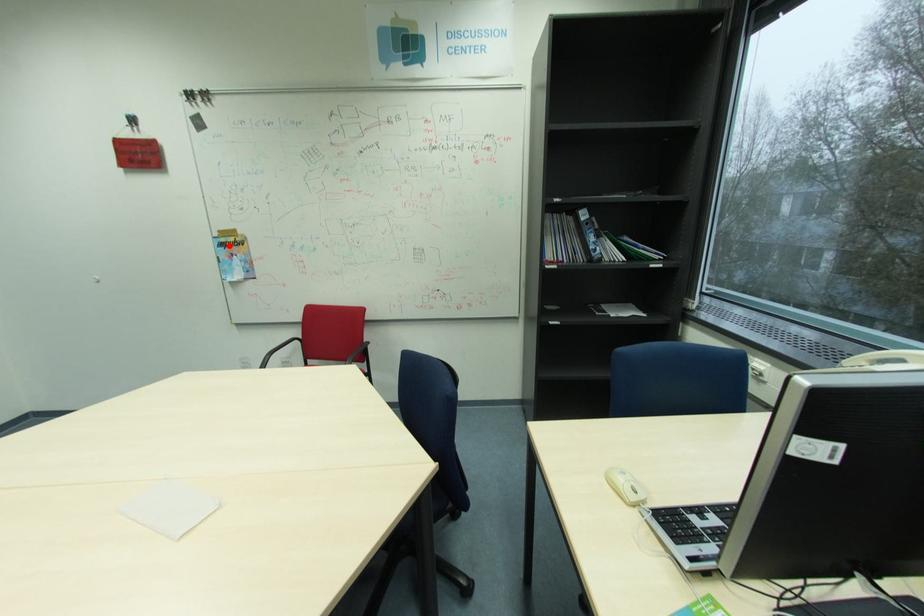
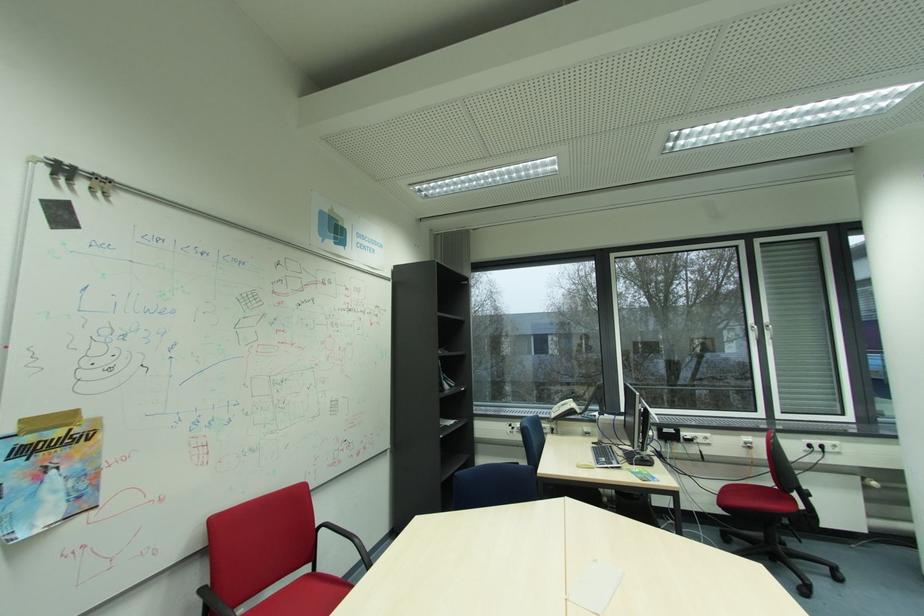
In the second image, find the point that corresponds to the highlighted location in the first image.

(31, 452)